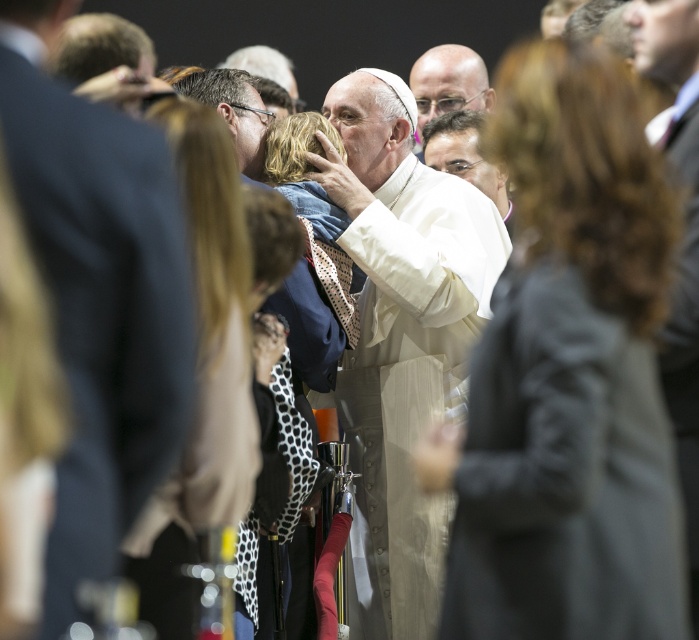
You are a photographer at the event and need to capture a closeup of the dark gray coat at center and white clothed figure at center. Which object will appear narrower in your photo?

The dark gray coat at center is thinner than the white clothed figure at center, so the dark gray coat at center will appear narrower in the photo.